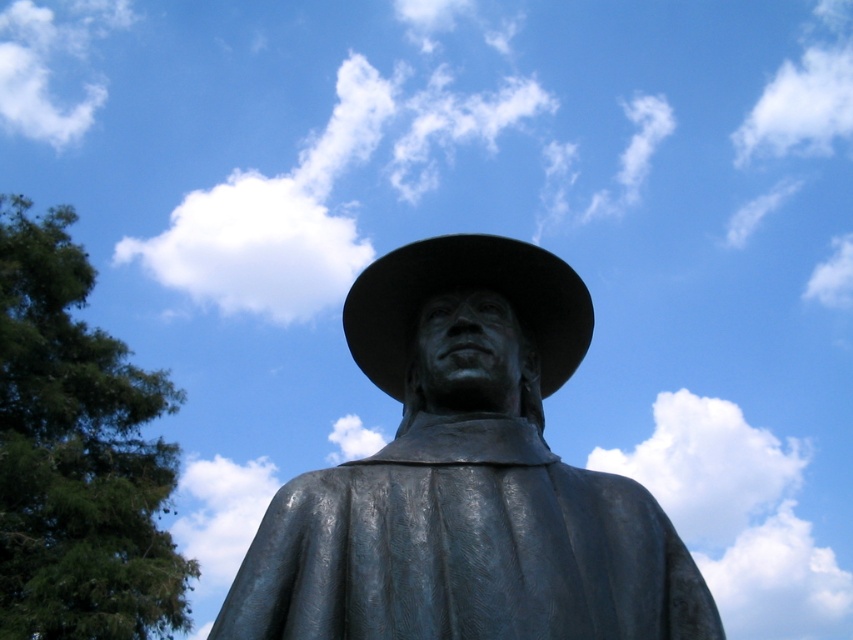
Question: Which object appears farthest from the camera in this image?

Choices:
 (A) white fluffy cloud at upper left
 (B) white fluffy cloud at upper center
 (C) shiny black cowboy hat at center

Answer: (A)

Question: Does bronze statue at center have a smaller size compared to shiny black cowboy hat at center?

Choices:
 (A) no
 (B) yes

Answer: (A)

Question: Estimate the real-world distances between objects in this image. Which object is farther from the bronze statue at center?

Choices:
 (A) shiny black cowboy hat at center
 (B) white fluffy cloud at upper center

Answer: (B)

Question: Which point appears closest to the camera in this image?

Choices:
 (A) (358, 298)
 (B) (270, 186)
 (C) (71, 20)
 (D) (277, 556)

Answer: (D)

Question: Can you confirm if shiny black cowboy hat at center is smaller than white fluffy cloud at upper left?

Choices:
 (A) no
 (B) yes

Answer: (B)

Question: Can you confirm if white fluffy cloud at upper center is positioned to the right of white fluffy cloud at upper left?

Choices:
 (A) yes
 (B) no

Answer: (A)